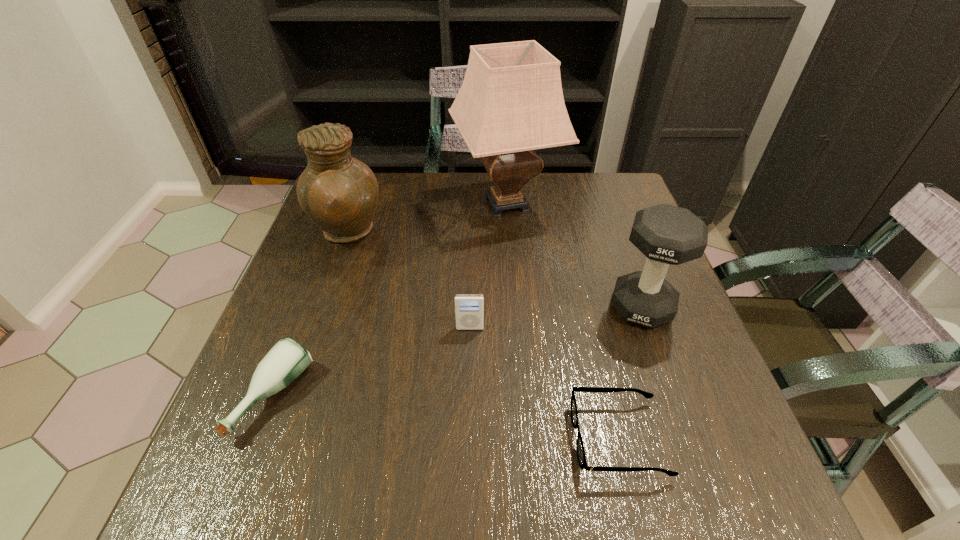
Locate an element on the screen. The width and height of the screenshot is (960, 540). spectacles located in the right edge section of the desktop is located at coordinates (581, 456).

You are a GUI agent. You are given a task and a screenshot of the screen. Output one action in this format:
    pyautogui.click(x=<x>, y=<y>)
    Task: Click on the object that is positioned at the far left corner
    The width and height of the screenshot is (960, 540).
    Given the screenshot: What is the action you would take?
    pyautogui.click(x=339, y=193)

You are a GUI agent. You are given a task and a screenshot of the screen. Output one action in this format:
    pyautogui.click(x=<x>, y=<y>)
    Task: Click on the object located at the near right corner
    This screenshot has width=960, height=540.
    Given the screenshot: What is the action you would take?
    pyautogui.click(x=581, y=456)

In order to click on vacant space at the far edge of the desktop in this screenshot , I will do `click(538, 182)`.

Identify the location of vacant space at the near edge. The width and height of the screenshot is (960, 540). (567, 461).

This screenshot has width=960, height=540. Identify the location of vacant space at the left edge of the desktop. (312, 241).

Where is `vacant space at the right edge`? Image resolution: width=960 pixels, height=540 pixels. vacant space at the right edge is located at coordinates (617, 272).

The height and width of the screenshot is (540, 960). In order to click on vacant space at the far right corner in this screenshot , I will do `click(603, 204)`.

This screenshot has height=540, width=960. What are the coordinates of `vacant area at the near right corner of the desktop` in the screenshot? It's located at (776, 509).

Locate an element on the screen. The height and width of the screenshot is (540, 960). vacant area that lies between the fourth tallest object and the dumbbell is located at coordinates (556, 318).